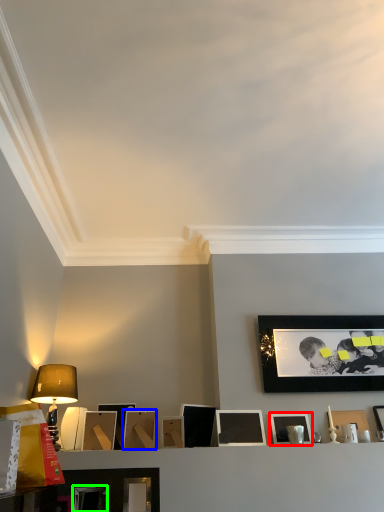
Question: Which is farther away from picture frame (highlighted by a red box)? picture frame (highlighted by a blue box) or picture frame (highlighted by a green box)?

Choices:
 (A) picture frame
 (B) picture frame

Answer: (B)